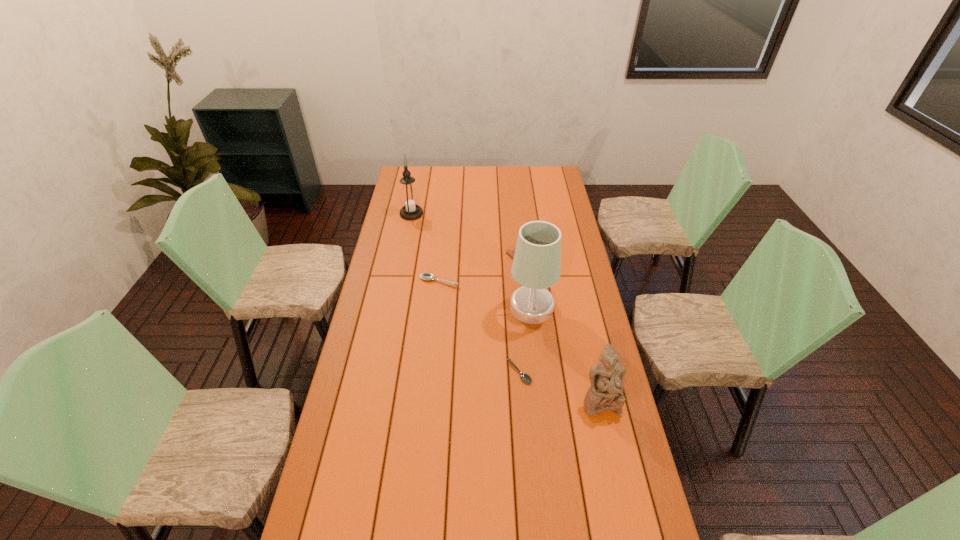
Locate an element on the screen. The height and width of the screenshot is (540, 960). free spot between the second farthest object and the third tallest object is located at coordinates (563, 327).

You are a GUI agent. You are given a task and a screenshot of the screen. Output one action in this format:
    pyautogui.click(x=<x>, y=<y>)
    Task: Click on the vacant point located between the figurine and the farthest object
    This screenshot has height=540, width=960.
    Given the screenshot: What is the action you would take?
    pyautogui.click(x=506, y=307)

Where is `vacant area between the leftmost object and the fifth nearest object`? vacant area between the leftmost object and the fifth nearest object is located at coordinates (468, 233).

Find the location of a particular element. vacant space that is in between the fourth tallest object and the figurine is located at coordinates 519,341.

You are a GUI agent. You are given a task and a screenshot of the screen. Output one action in this format:
    pyautogui.click(x=<x>, y=<y>)
    Task: Click on the vacant space that's between the shorter soupspoon and the farther soupspoon
    The width and height of the screenshot is (960, 540).
    Given the screenshot: What is the action you would take?
    479,327

This screenshot has width=960, height=540. Identify the location of vacant space that's between the fourth tallest object and the rightmost object. (519, 341).

Select which object is the fifth closest to the nearer soupspoon. Please provide its 2D coordinates. Your answer should be formatted as a tuple, i.e. [(x, y)], where the tuple contains the x and y coordinates of a point satisfying the conditions above.

[(409, 198)]

Identify the location of the fifth closest object to the fifth nearest object. (606, 378).